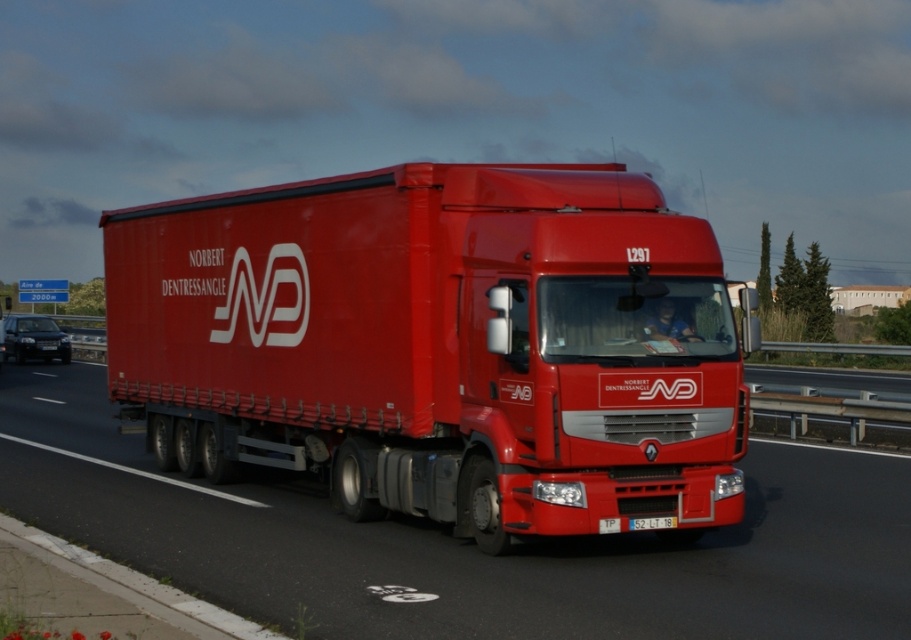
Image resolution: width=911 pixels, height=640 pixels. Describe the element at coordinates (439, 346) in the screenshot. I see `matte red trailer truck at center` at that location.

Describe the element at coordinates (439, 346) in the screenshot. This screenshot has width=911, height=640. I see `matte red trailer truck at center` at that location.

Find the location of `matte red trailer truck at center`. matte red trailer truck at center is located at coordinates (439, 346).

At what (x,y) coordinates should I click in order to perform the action: click on matte red truck at center. Please return your answer as a coordinate pair (x, y). Looking at the image, I should click on (462, 541).

Can you confirm if matte red truck at center is thinner than white plastic license plate at center?

In fact, matte red truck at center might be wider than white plastic license plate at center.

This screenshot has width=911, height=640. What do you see at coordinates (462, 541) in the screenshot?
I see `matte red truck at center` at bounding box center [462, 541].

Find the location of a particular element. matte red truck at center is located at coordinates (462, 541).

Does matte red trailer truck at center appear on the left side of white plastic license plate at center?

Yes, matte red trailer truck at center is to the left of white plastic license plate at center.

Between point (456, 474) and point (660, 525), which one is positioned in front?

Point (660, 525) is more forward.

Locate an element on the screen. matte red trailer truck at center is located at coordinates (439, 346).

Find the location of a particular element. matte red trailer truck at center is located at coordinates (439, 346).